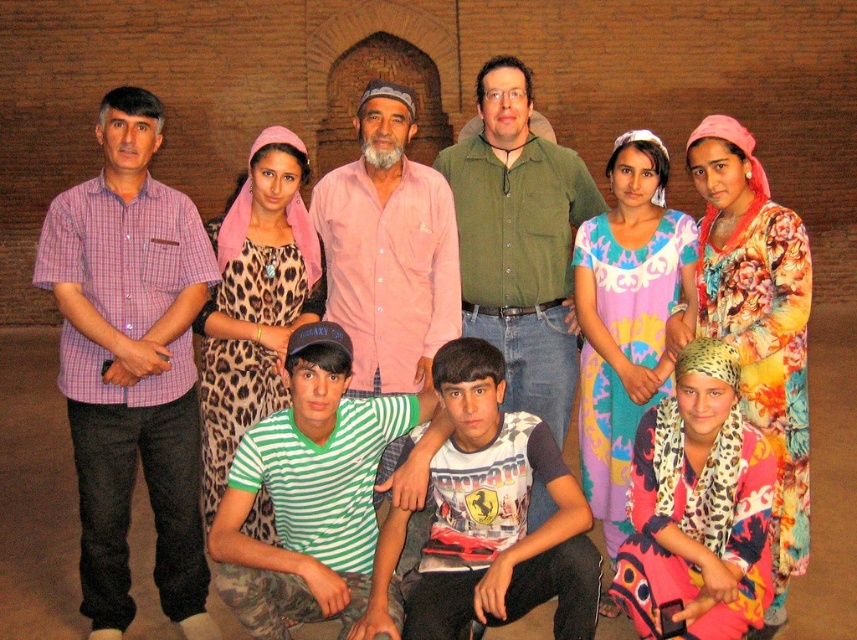
You are a photographer trying to adjust the composition of the group photo. You notice the leopard print dress at lower right and the plaid cotton shirt at left. Which clothing item is positioned closer to the camera?

The leopard print dress at lower right is behind the plaid cotton shirt at left, so the plaid cotton shirt at left is closer to the camera.

You are a photographer trying to adjust the lighting for a group photo. You notice two people in the scene wearing a plaid cotton shirt at left and a green striped shirt at center. Which of these two shirts is closer to you?

The plaid cotton shirt at left is closer to you because it is further to the viewer than the green striped shirt at center.